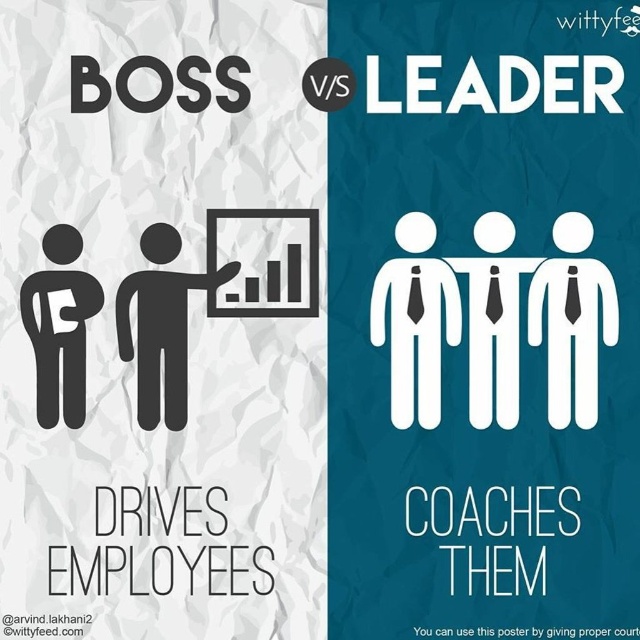
Question: From the image, what is the correct spatial relationship of white paper people at center in relation to black figure at center?

Choices:
 (A) left
 (B) right

Answer: (B)

Question: Which point is farther from the camera taking this photo?

Choices:
 (A) (429, 397)
 (B) (592, 628)
 (C) (58, 260)

Answer: (C)

Question: Estimate the real-world distances between objects in this image. Which object is closer to the white paper people at center?

Choices:
 (A) matte black figure at left
 (B) black figure at center

Answer: (B)

Question: Can you confirm if white paper at center is thinner than white paper people at center?

Choices:
 (A) no
 (B) yes

Answer: (A)

Question: Does white paper at center appear under matte black figure at left?

Choices:
 (A) yes
 (B) no

Answer: (B)

Question: Among these objects, which one is farthest from the camera?

Choices:
 (A) matte black figure at left
 (B) black figure at center
 (C) white paper at center

Answer: (A)